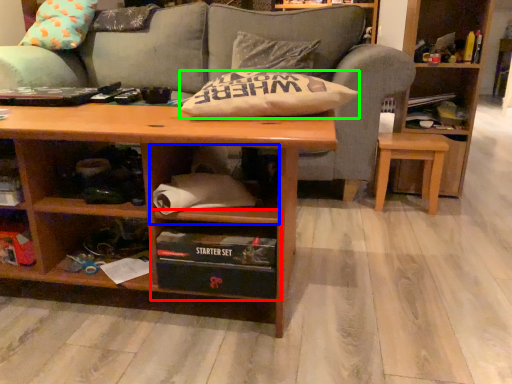
Question: Which is nearer to the cabinet (highlighted by a red box)? cabinet (highlighted by a blue box) or pillow (highlighted by a green box).

Choices:
 (A) cabinet
 (B) pillow

Answer: (A)